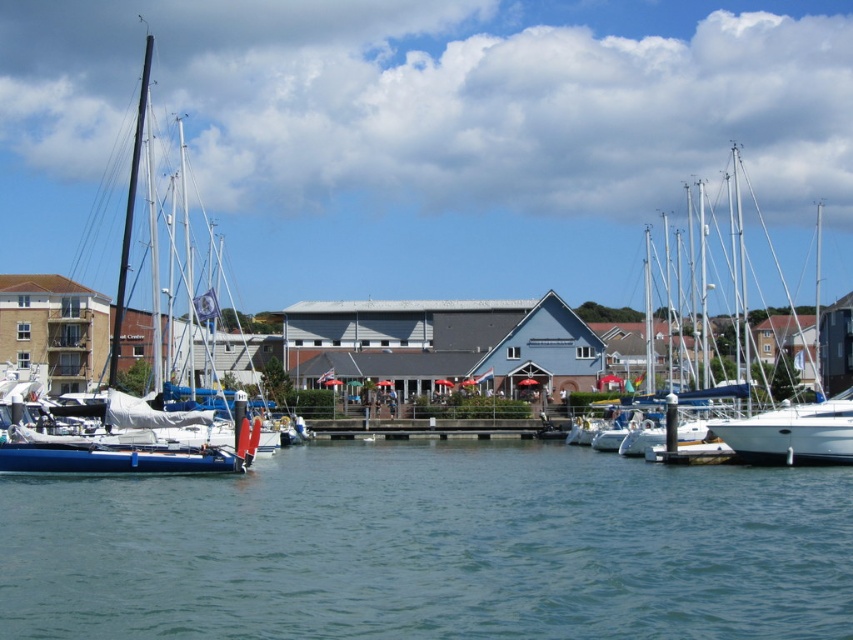
Which of these two, clear blue water at center or white matte sailboat at left, stands shorter?

Standing shorter between the two is clear blue water at center.

This screenshot has height=640, width=853. What do you see at coordinates (431, 548) in the screenshot? I see `clear blue water at center` at bounding box center [431, 548].

The width and height of the screenshot is (853, 640). I want to click on clear blue water at center, so click(x=431, y=548).

Is point (706, 500) less distant than point (764, 397)?

Yes, point (706, 500) is closer to viewer.

Can you confirm if clear blue water at center is positioned to the right of white glossy sailboat at right?

Incorrect, clear blue water at center is not on the right side of white glossy sailboat at right.

Does point (508, 465) lie in front of point (796, 442)?

No, (508, 465) is further to viewer.

Identify the location of clear blue water at center. Image resolution: width=853 pixels, height=640 pixels. (431, 548).

Who is positioned more to the left, white glossy sailboat at right or white matte sailboat at left?

Positioned to the left is white matte sailboat at left.

Is white glossy sailboat at right closer to the viewer compared to white matte sailboat at left?

No, it is not.

Which is behind, point (683, 387) or point (39, 467)?

The point (683, 387) is more distant.

The height and width of the screenshot is (640, 853). Identify the location of white glossy sailboat at right. (708, 310).